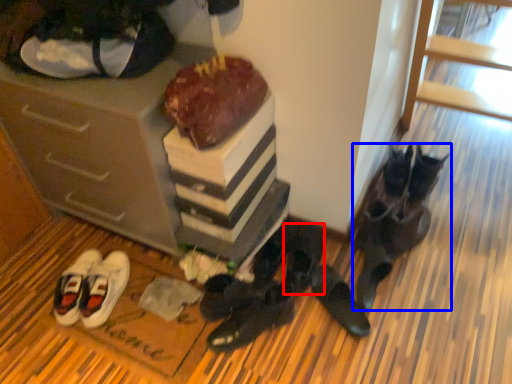
Question: Which object is closer to the camera taking this photo, footwear (highlighted by a red box) or footwear (highlighted by a blue box)?

Choices:
 (A) footwear
 (B) footwear

Answer: (B)